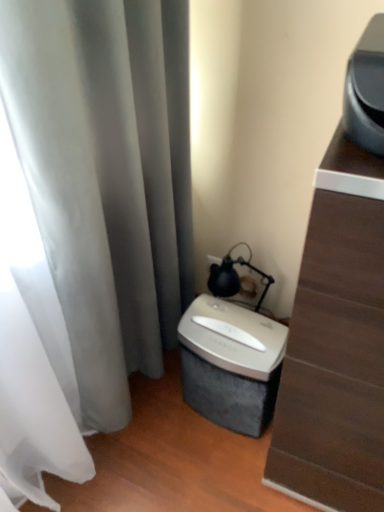
Question: Considering the positions of silver metallic shredder at lower center and matte black lamp at upper right in the image, is silver metallic shredder at lower center taller or shorter than matte black lamp at upper right?

Choices:
 (A) short
 (B) tall

Answer: (B)

Question: Is point (180, 361) positioned closer to the camera than point (236, 291)?

Choices:
 (A) closer
 (B) farther

Answer: (A)

Question: Which is farther from the silver metallic shredder at lower center?

Choices:
 (A) matte black lamp at upper right
 (B) silver metallic shredder at lower center

Answer: (A)

Question: Which of these objects is positioned closest to the silver metallic shredder at lower center?

Choices:
 (A) silver metallic shredder at lower center
 (B) matte black lamp at upper right

Answer: (A)